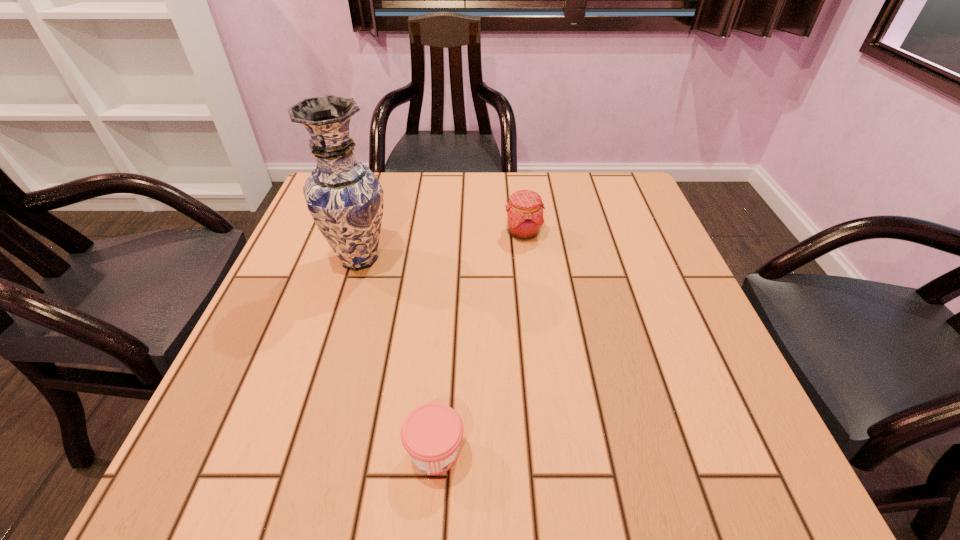
This screenshot has height=540, width=960. In order to click on object at the near edge in this screenshot , I will do [x=431, y=434].

Locate an element on the screen. The image size is (960, 540). object present at the left edge is located at coordinates (344, 197).

This screenshot has width=960, height=540. In order to click on blank area at the far edge in this screenshot , I will do `click(388, 206)`.

The width and height of the screenshot is (960, 540). I want to click on vacant space at the near edge, so click(x=344, y=458).

In the image, there is a desktop. Where is `free region at the left edge`? free region at the left edge is located at coordinates (301, 413).

The width and height of the screenshot is (960, 540). In order to click on free space at the right edge of the desktop in this screenshot , I will do tap(640, 281).

This screenshot has height=540, width=960. I want to click on vacant space at the near left corner, so click(200, 459).

The height and width of the screenshot is (540, 960). I want to click on vacant area at the far right corner, so click(588, 180).

In order to click on free region at the near right corner of the desktop in this screenshot , I will do `click(725, 466)`.

You are a GUI agent. You are given a task and a screenshot of the screen. Output one action in this format:
    pyautogui.click(x=<x>, y=<y>)
    Task: Click on the empty space that is in between the second object from right to left and the leftmost object
    This screenshot has width=960, height=540.
    Given the screenshot: What is the action you would take?
    pyautogui.click(x=397, y=355)